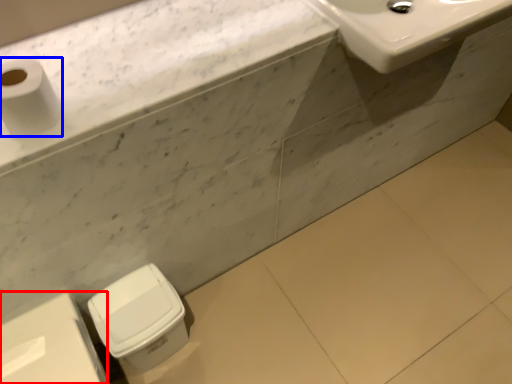
Question: Which of the following is the closest to the observer, porcelain (highlighted by a red box) or toilet paper (highlighted by a blue box)?

Choices:
 (A) porcelain
 (B) toilet paper

Answer: (B)